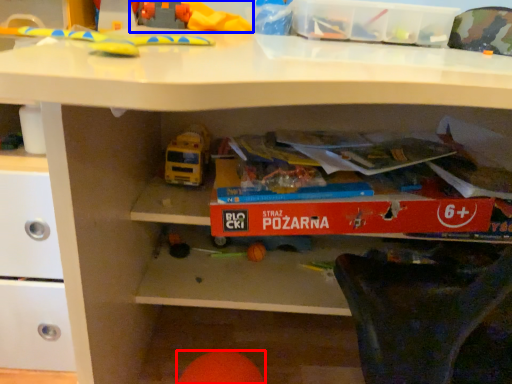
Question: Which of the following is the farthest to the observer, toy (highlighted by a red box) or toy (highlighted by a blue box)?

Choices:
 (A) toy
 (B) toy

Answer: (B)